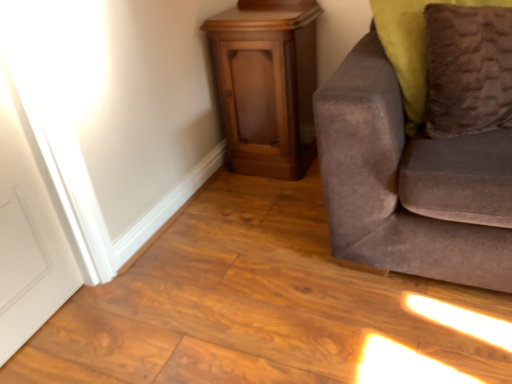
Where is `free location to the left of suede gray couch at right`? The height and width of the screenshot is (384, 512). free location to the left of suede gray couch at right is located at coordinates (242, 259).